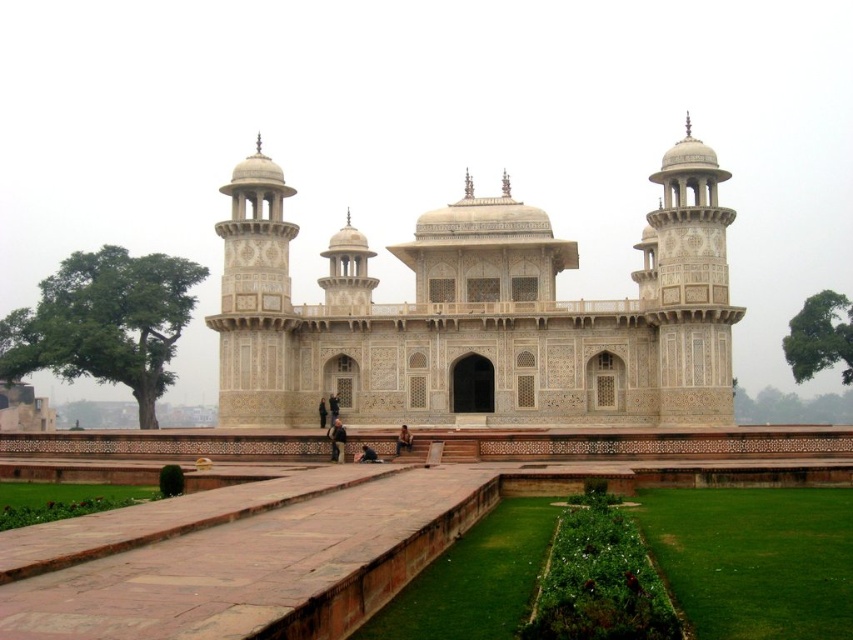
Question: Which point is closer to the camera taking this photo?

Choices:
 (A) (397, 438)
 (B) (323, 424)
 (C) (683, 321)

Answer: (A)

Question: Which object is closer to the camera taking this photo?

Choices:
 (A) dark brown leather jacket at lower center
 (B) smooth beige person at center
 (C) dark blue fabric at center
 (D) dark gray suit at center

Answer: (A)

Question: Is white marble palace at center closer to the viewer compared to dark brown leather jacket at center?

Choices:
 (A) no
 (B) yes

Answer: (A)

Question: Can you confirm if white marble palace at center is positioned above dark brown leather jacket at center?

Choices:
 (A) yes
 (B) no

Answer: (A)

Question: Based on their relative distances, which object is farther from the dark brown leather jacket at center?

Choices:
 (A) smooth beige person at center
 (B) dark gray suit at center
 (C) dark brown leather jacket at lower center
 (D) white marble palace at center

Answer: (D)

Question: Is dark brown leather jacket at center closer to the viewer compared to dark blue fabric at center?

Choices:
 (A) yes
 (B) no

Answer: (A)